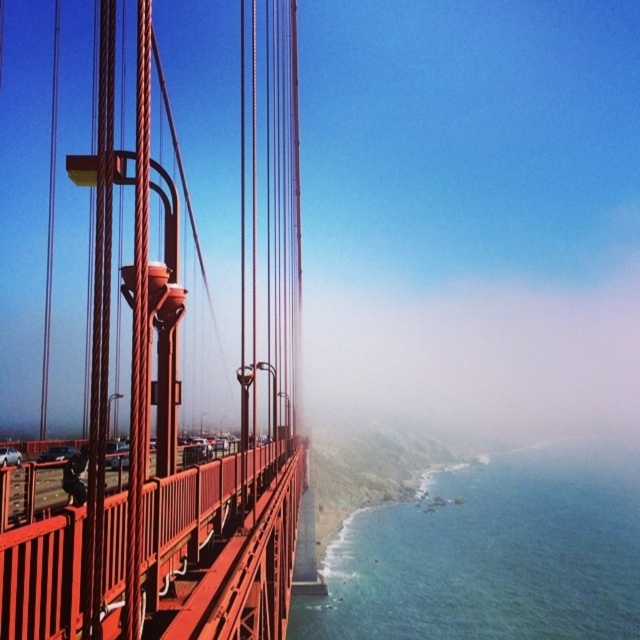
Question: Which point is closer to the camera?

Choices:
 (A) (288, 33)
 (B) (376, 515)

Answer: (A)

Question: Which point appears farthest from the camera in this image?

Choices:
 (A) (568, 596)
 (B) (163, 433)

Answer: (A)

Question: Is smooth metal suspension bridge at left bigger than blue water at lower right?

Choices:
 (A) yes
 (B) no

Answer: (A)

Question: Can you confirm if smooth metal suspension bridge at left is wider than blue water at lower right?

Choices:
 (A) no
 (B) yes

Answer: (A)

Question: Does smooth metal suspension bridge at left appear over blue water at lower right?

Choices:
 (A) yes
 (B) no

Answer: (A)